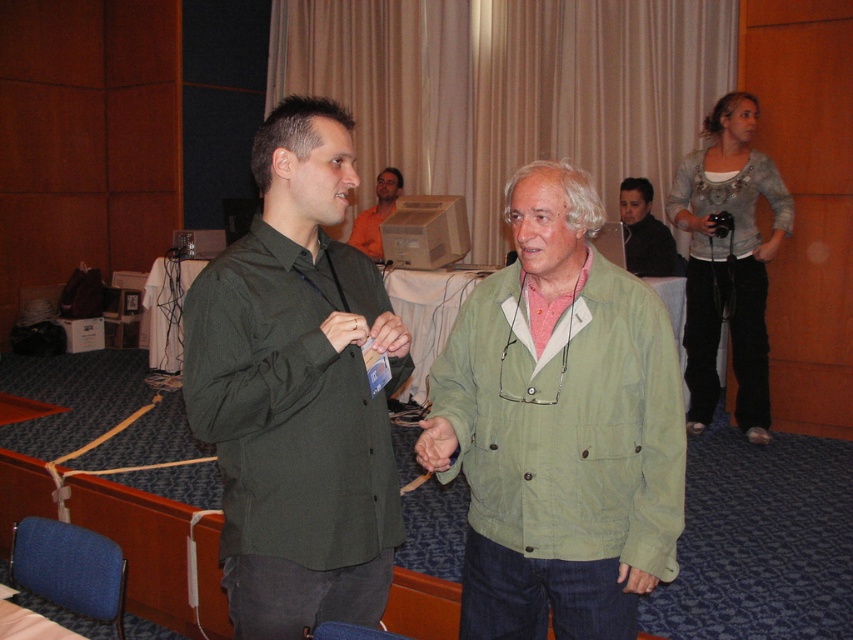
Does green matte shirt at center lie in front of dark gray jacket at upper right?

That is True.

Locate an element on the screen. The image size is (853, 640). green matte shirt at center is located at coordinates (297, 390).

Between green matte shirt at center and orange shirt at upper center, which one is positioned lower?

green matte shirt at center is below.

Can you confirm if green matte shirt at center is positioned to the left of orange shirt at upper center?

No, green matte shirt at center is not to the left of orange shirt at upper center.

Does point (213, 272) lie in front of point (370, 216)?

Yes, it is.

Where is `green matte shirt at center`? green matte shirt at center is located at coordinates (297, 390).

Who is positioned more to the left, dark gray jacket at upper right or orange shirt at upper center?

orange shirt at upper center

Measure the distance between point (x=676, y=253) and camera.

They are 5.20 meters apart.

Is point (660, 234) farther from camera compared to point (397, 193)?

No, (660, 234) is closer to viewer.

At what (x,y) coordinates should I click in order to perform the action: click on dark gray jacket at upper right. Please return your answer as a coordinate pair (x, y). Image resolution: width=853 pixels, height=640 pixels. Looking at the image, I should click on (643, 230).